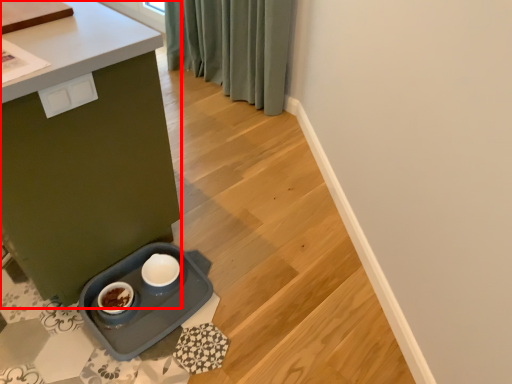
Question: Observing the image, what is the correct spatial positioning of table (annotated by the red box) in reference to drawer?

Choices:
 (A) right
 (B) left

Answer: (B)